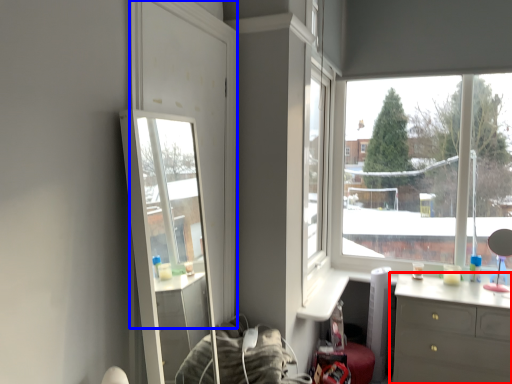
Question: Among these objects, which one is farthest to the camera, chest of drawers (highlighted by a red box) or glass door (highlighted by a blue box)?

Choices:
 (A) chest of drawers
 (B) glass door

Answer: (A)